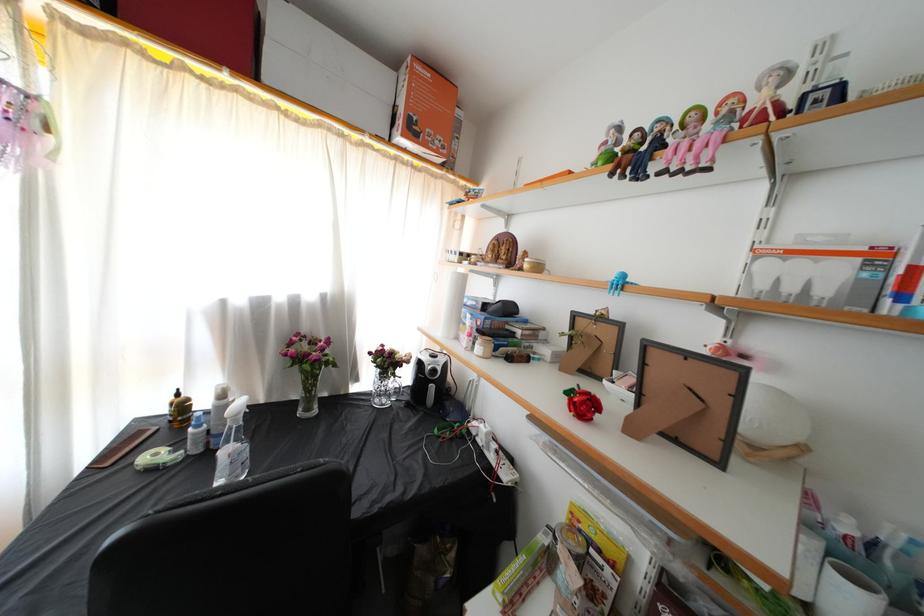
Find where to push the brown pump dispenser top. Please return your answer as a coordinate pair (x, y).

(175, 402)